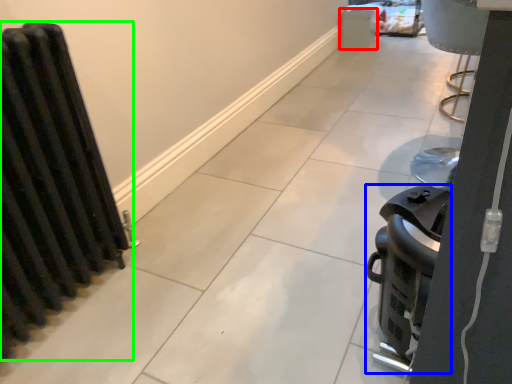
Question: Which object is positioned farthest from appliance (highlighted by a red box)? Select from appliance (highlighted by a blue box) and radiator (highlighted by a green box).

Choices:
 (A) appliance
 (B) radiator

Answer: (B)